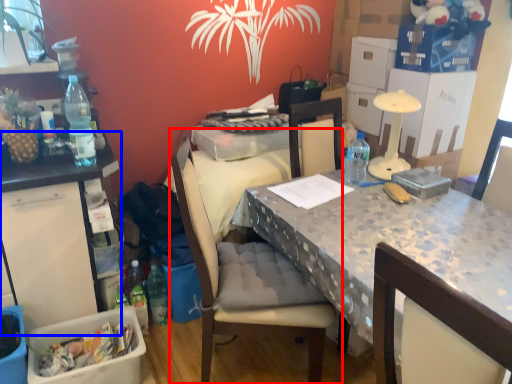
Question: Which of the following is the farthest to the observer, chair (highlighted by a red box) or table (highlighted by a blue box)?

Choices:
 (A) chair
 (B) table

Answer: (B)